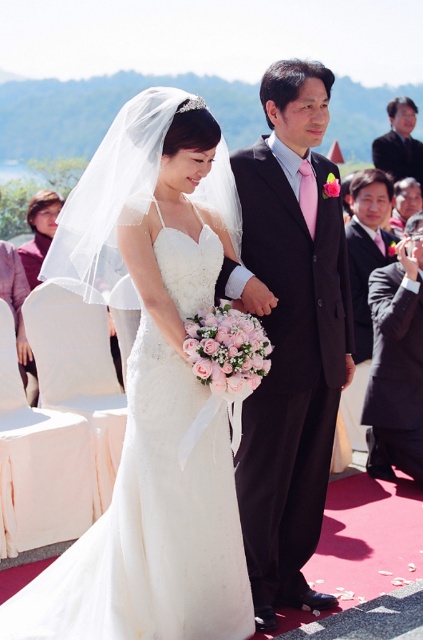
You are a photographer setting up for the wedding photoshoot. You need to ensure that both the white satin dress at center and the black satin suit at right are fully visible in the frame. Given that the camera lens has a limited depth of field, which subject should you focus on to ensure both are in focus?

The white satin dress at center is not as tall as the black satin suit at right, so focusing on the taller subject, the black satin suit at right, will help ensure both are in focus due to the depth of field range covering both heights.

You are a photographer at the wedding and need to adjust the camera focus. Which of the two subjects, the black suit at right or the dark suit at upper right, is closer to the camera?

The black suit at right is closer to the camera because it is in front of the dark suit at upper right.

You are a photographer setting up for a wedding photo. You need to position a backdrop behind the matte black suit at center and the black satin suit at right so that both are fully visible. Given that the backdrop can only extend to a certain height, which suit requires the backdrop to be taller?

The matte black suit at center requires the backdrop to be taller because it is much taller than the black satin suit at right.